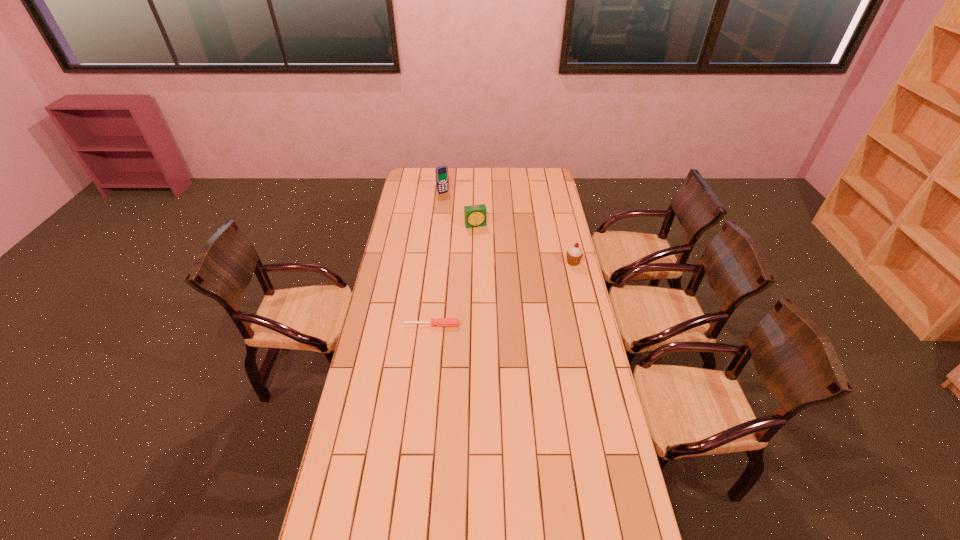
Where is `free space located on the front-facing side of the second farthest object`? Image resolution: width=960 pixels, height=540 pixels. free space located on the front-facing side of the second farthest object is located at coordinates (480, 237).

The width and height of the screenshot is (960, 540). I want to click on free space located on the front-facing side of the second farthest object, so click(493, 275).

Find the location of `vacant space located 0.350m on the front-facing side of the second farthest object`. vacant space located 0.350m on the front-facing side of the second farthest object is located at coordinates (492, 271).

The image size is (960, 540). Identify the location of free location located 0.230m on the front-facing side of the tallest object. pyautogui.click(x=462, y=214).

You are a GUI agent. You are given a task and a screenshot of the screen. Output one action in this format:
    pyautogui.click(x=<x>, y=<y>)
    Task: Click on the vacant area situated 0.170m on the front-facing side of the tallest object
    
    Given the screenshot: What is the action you would take?
    pyautogui.click(x=458, y=209)

In order to click on vacant point located 0.060m on the front-facing side of the tallest object in this screenshot , I will do `click(449, 199)`.

Where is `object present at the left edge`? object present at the left edge is located at coordinates tap(440, 322).

This screenshot has height=540, width=960. I want to click on object at the right edge, so click(574, 254).

This screenshot has width=960, height=540. What are the coordinates of `vacant area at the far edge` in the screenshot? It's located at (518, 180).

Locate an element on the screen. vacant space at the near edge of the desktop is located at coordinates (439, 519).